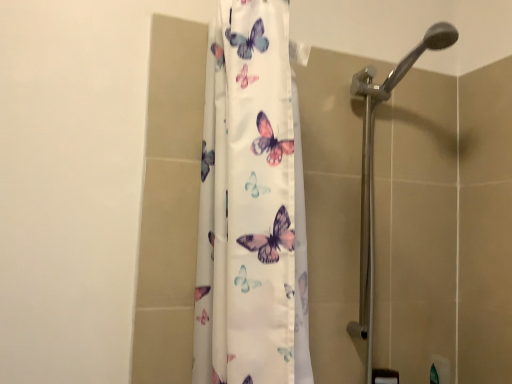
Identify the location of silver metallic shower head at upper right. The height and width of the screenshot is (384, 512). (373, 173).

The height and width of the screenshot is (384, 512). What do you see at coordinates (373, 173) in the screenshot?
I see `silver metallic shower head at upper right` at bounding box center [373, 173].

Find the location of a particular element. The image size is (512, 384). silver metallic shower head at upper right is located at coordinates (373, 173).